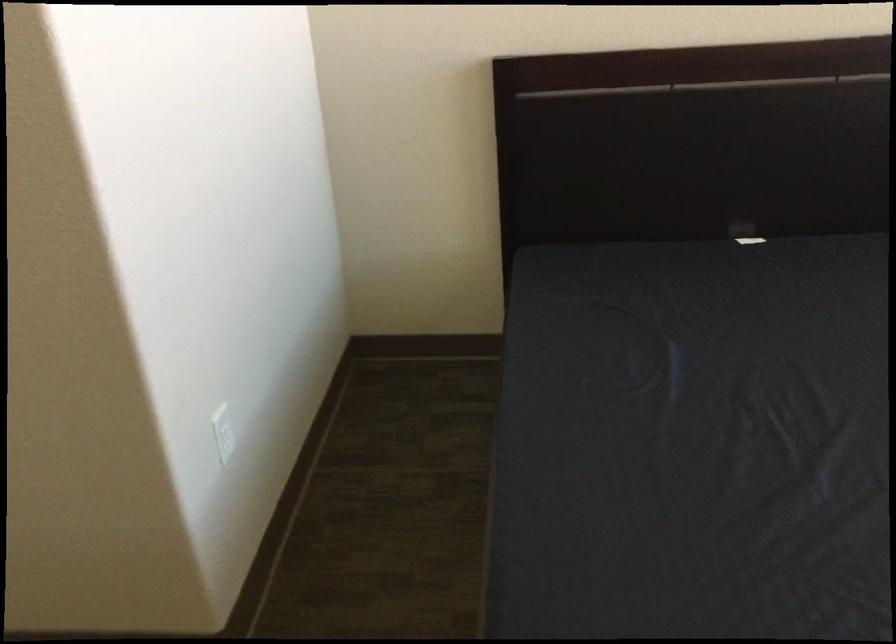
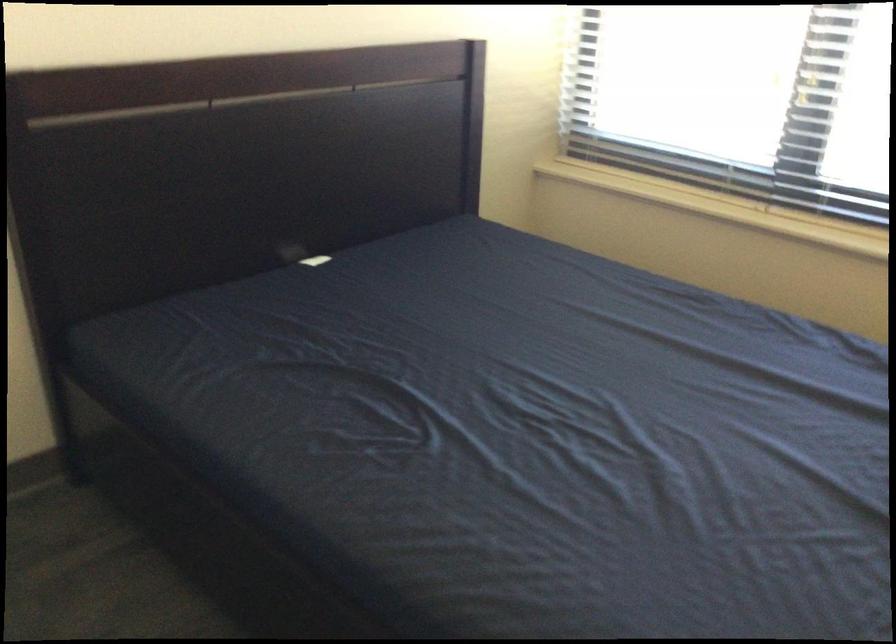
Question: The camera is either moving clockwise (left) or counter-clockwise (right) around the object. The first image is from the beginning of the video and the second image is from the end. Is the camera moving left or right when shooting the video?

Choices:
 (A) Left
 (B) Right

Answer: (A)